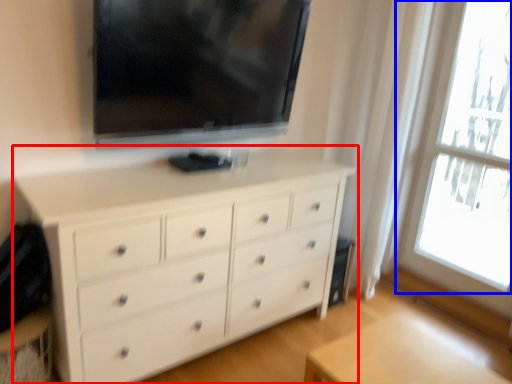
Question: Which of the following is the farthest to the observer, chest of drawers (highlighted by a red box) or window (highlighted by a blue box)?

Choices:
 (A) chest of drawers
 (B) window

Answer: (B)